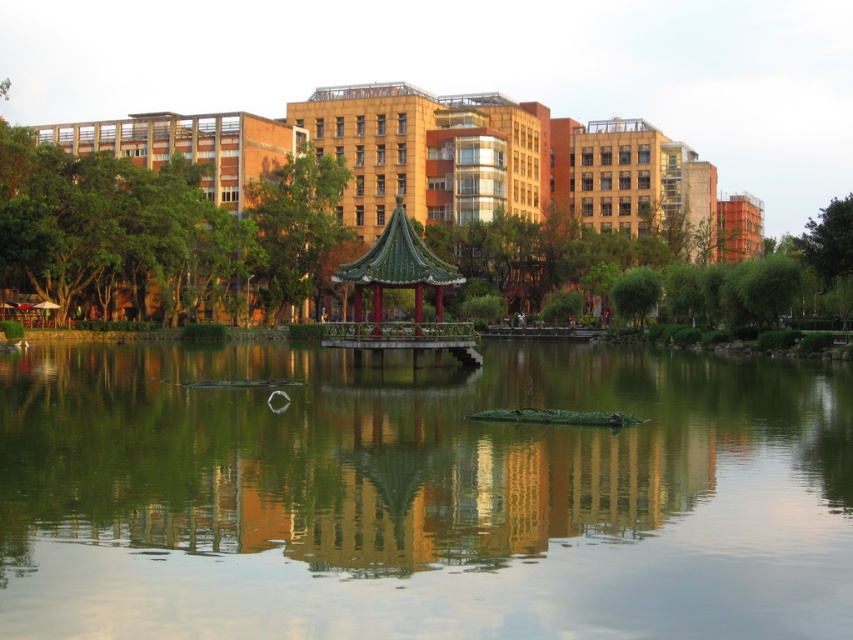
Who is lower down, green reflective water at center or green glazed tile gazebo at center?

green reflective water at center is lower down.

Who is more distant from viewer, (113, 605) or (366, 257)?

Positioned behind is point (366, 257).

This screenshot has height=640, width=853. Identify the location of green reflective water at center. (421, 497).